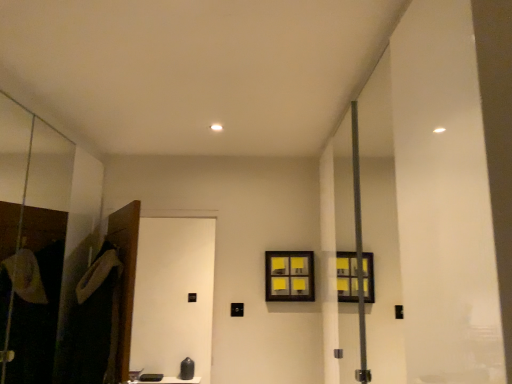
Describe the element at coordinates (31, 240) in the screenshot. This screenshot has width=512, height=384. I see `transparent glass screen door at left, the 1th screen door viewed from the left` at that location.

The height and width of the screenshot is (384, 512). Identify the location of dark gray fabric robe at left. (93, 323).

Where is `transparent glass screen door at left, marked as the 2th screen door in a right-to-left arrangement`? Image resolution: width=512 pixels, height=384 pixels. transparent glass screen door at left, marked as the 2th screen door in a right-to-left arrangement is located at coordinates (31, 240).

Measure the distance from dark gray fabric robe at left to transparent glass screen door at left, the 1th screen door viewed from the left.

A distance of 11.78 inches exists between dark gray fabric robe at left and transparent glass screen door at left, the 1th screen door viewed from the left.

Relative to transparent glass screen door at left, marked as the 2th screen door in a right-to-left arrangement, is dark gray fabric robe at left in front or behind?

Visually, dark gray fabric robe at left is located behind transparent glass screen door at left, marked as the 2th screen door in a right-to-left arrangement.

Locate an element on the screen. The width and height of the screenshot is (512, 384). screen door that is the 2nd one above the dark gray fabric robe at left (from a real-world perspective) is located at coordinates (31, 240).

Is dark gray fabric robe at left at the left side of transparent glass screen door at left, the 1th screen door viewed from the left?

In fact, dark gray fabric robe at left is to the right of transparent glass screen door at left, the 1th screen door viewed from the left.

From the image's perspective, is transparent glass screen door at left, the 1th screen door viewed from the left, positioned above or below black matte screen door at lower left, which is the 2th screen door in left-to-right order?

transparent glass screen door at left, the 1th screen door viewed from the left, is situated higher than black matte screen door at lower left, which is the 2th screen door in left-to-right order, in the image.

Which object is closer to the camera taking this photo, transparent glass screen door at left, the 1th screen door viewed from the left, or black matte screen door at lower left, which is the 2th screen door in left-to-right order?

Positioned in front is transparent glass screen door at left, the 1th screen door viewed from the left.

Which object is positioned more to the left, transparent glass screen door at left, marked as the 2th screen door in a right-to-left arrangement, or black matte screen door at lower left, which appears as the 1th screen door when viewed from the right?

From the viewer's perspective, transparent glass screen door at left, marked as the 2th screen door in a right-to-left arrangement, appears more on the left side.

Which is in front, point (3, 97) or point (203, 240)?

Point (3, 97)

Is black matte screen door at lower left, which is the 2th screen door in left-to-right order, next to yellow sticky notes at center and touching it?

black matte screen door at lower left, which is the 2th screen door in left-to-right order, is not next to yellow sticky notes at center, and they're not touching.

From a real-world perspective, is black matte screen door at lower left, which is the 2th screen door in left-to-right order, above or below yellow sticky notes at center?

Clearly, from a real-world perspective, black matte screen door at lower left, which is the 2th screen door in left-to-right order, is below yellow sticky notes at center.

Considering the positions of objects black matte screen door at lower left, which appears as the 1th screen door when viewed from the right, and yellow sticky notes at center in the image provided, who is more to the left, black matte screen door at lower left, which appears as the 1th screen door when viewed from the right, or yellow sticky notes at center?

black matte screen door at lower left, which appears as the 1th screen door when viewed from the right, is more to the left.

Is black matte screen door at lower left, which is the 2th screen door in left-to-right order, completely or partially outside of yellow sticky notes at center?

Yes, black matte screen door at lower left, which is the 2th screen door in left-to-right order, is not within yellow sticky notes at center.

Does black matte screen door at lower left, which appears as the 1th screen door when viewed from the right, appear on the left side of transparent glass screen door at left, marked as the 2th screen door in a right-to-left arrangement?

Incorrect, black matte screen door at lower left, which appears as the 1th screen door when viewed from the right, is not on the left side of transparent glass screen door at left, marked as the 2th screen door in a right-to-left arrangement.

The height and width of the screenshot is (384, 512). I want to click on screen door lying behind the transparent glass screen door at left, marked as the 2th screen door in a right-to-left arrangement, so click(x=174, y=296).

In the scene shown: Can you confirm if black matte screen door at lower left, which appears as the 1th screen door when viewed from the right, is taller than transparent glass screen door at left, marked as the 2th screen door in a right-to-left arrangement?

Incorrect, the height of black matte screen door at lower left, which appears as the 1th screen door when viewed from the right, is not larger of that of transparent glass screen door at left, marked as the 2th screen door in a right-to-left arrangement.

Could transparent glass screen door at left, marked as the 2th screen door in a right-to-left arrangement, be considered to be inside black matte screen door at lower left, which is the 2th screen door in left-to-right order?

That's incorrect, transparent glass screen door at left, marked as the 2th screen door in a right-to-left arrangement, is not inside black matte screen door at lower left, which is the 2th screen door in left-to-right order.

From the image's perspective, is dark gray fabric robe at left located above or below black matte screen door at lower left, which appears as the 1th screen door when viewed from the right?

dark gray fabric robe at left is above black matte screen door at lower left, which appears as the 1th screen door when viewed from the right.

Identify the location of screen door that appears on the right of dark gray fabric robe at left. (174, 296).

Is point (95, 331) closer to camera compared to point (190, 341)?

Yes, it is.

Could you tell me if dark gray fabric robe at left is turned towards black matte screen door at lower left, which appears as the 1th screen door when viewed from the right?

No.

Is transparent glass screen door at left, the 1th screen door viewed from the left, not near dark gray fabric robe at left?

They are positioned close to each other.

Image resolution: width=512 pixels, height=384 pixels. I want to click on robe below the transparent glass screen door at left, marked as the 2th screen door in a right-to-left arrangement (from the image's perspective), so click(93, 323).

Between transparent glass screen door at left, marked as the 2th screen door in a right-to-left arrangement, and dark gray fabric robe at left, which one has larger width?

Wider between the two is dark gray fabric robe at left.

Is transparent glass screen door at left, the 1th screen door viewed from the left, situated inside dark gray fabric robe at left or outside?

transparent glass screen door at left, the 1th screen door viewed from the left, lies outside dark gray fabric robe at left.

From the image's perspective, does transparent glass screen door at left, marked as the 2th screen door in a right-to-left arrangement, appear higher than yellow sticky notes at center?

Yes, from the image's perspective, transparent glass screen door at left, marked as the 2th screen door in a right-to-left arrangement, is on top of yellow sticky notes at center.

Could you tell me if transparent glass screen door at left, the 1th screen door viewed from the left, is facing yellow sticky notes at center?

Yes, transparent glass screen door at left, the 1th screen door viewed from the left, is oriented towards yellow sticky notes at center.

Considering the sizes of transparent glass screen door at left, marked as the 2th screen door in a right-to-left arrangement, and yellow sticky notes at center in the image, is transparent glass screen door at left, marked as the 2th screen door in a right-to-left arrangement, wider or thinner than yellow sticky notes at center?

Considering their sizes, transparent glass screen door at left, marked as the 2th screen door in a right-to-left arrangement, looks slimmer than yellow sticky notes at center.

Is transparent glass screen door at left, the 1th screen door viewed from the left, taller or shorter than yellow sticky notes at center?

Clearly, transparent glass screen door at left, the 1th screen door viewed from the left, is taller compared to yellow sticky notes at center.

Find the location of a particular element. screen door above the dark gray fabric robe at left (from the image's perspective) is located at coordinates (31, 240).

Where is `screen door located above the black matte screen door at lower left, which is the 2th screen door in left-to-right order (from a real-world perspective)`? screen door located above the black matte screen door at lower left, which is the 2th screen door in left-to-right order (from a real-world perspective) is located at coordinates (31, 240).

Looking at the image, which one is located further to dark gray fabric robe at left, transparent glass screen door at left, the 1th screen door viewed from the left, or yellow sticky notes at center?

Based on the image, yellow sticky notes at center appears to be further to dark gray fabric robe at left.

Considering their positions, is dark gray fabric robe at left positioned further to transparent glass screen door at left, marked as the 2th screen door in a right-to-left arrangement, than yellow sticky notes at center?

yellow sticky notes at center lies further to transparent glass screen door at left, marked as the 2th screen door in a right-to-left arrangement, than the other object.

Looking at the image, which one is located further to yellow sticky notes at center, black matte screen door at lower left, which appears as the 1th screen door when viewed from the right, or dark gray fabric robe at left?

black matte screen door at lower left, which appears as the 1th screen door when viewed from the right.

When comparing their distances from yellow sticky notes at center, does transparent glass screen door at left, marked as the 2th screen door in a right-to-left arrangement, or dark gray fabric robe at left seem closer?

Based on the image, dark gray fabric robe at left appears to be nearer to yellow sticky notes at center.

Considering their positions, is transparent glass screen door at left, the 1th screen door viewed from the left, positioned further to black matte screen door at lower left, which appears as the 1th screen door when viewed from the right, than yellow sticky notes at center?

transparent glass screen door at left, the 1th screen door viewed from the left, lies further to black matte screen door at lower left, which appears as the 1th screen door when viewed from the right, than the other object.

Considering their positions, is black matte screen door at lower left, which is the 2th screen door in left-to-right order, positioned closer to dark gray fabric robe at left than yellow sticky notes at center?

Result: yellow sticky notes at center is closer to dark gray fabric robe at left.

Based on their spatial positions, is yellow sticky notes at center or transparent glass screen door at left, the 1th screen door viewed from the left, closer to dark gray fabric robe at left?

Among the two, transparent glass screen door at left, the 1th screen door viewed from the left, is located nearer to dark gray fabric robe at left.

From the image, which object appears to be farther from black matte screen door at lower left, which is the 2th screen door in left-to-right order, yellow sticky notes at center or dark gray fabric robe at left?

dark gray fabric robe at left.

Find the location of a particular element. screen door between dark gray fabric robe at left and yellow sticky notes at center from left to right is located at coordinates (174, 296).

I want to click on screen door positioned between transparent glass screen door at left, the 1th screen door viewed from the left, and yellow sticky notes at center from near to far, so click(x=174, y=296).

What are the coordinates of `robe situated between transparent glass screen door at left, marked as the 2th screen door in a right-to-left arrangement, and yellow sticky notes at center from left to right` in the screenshot? It's located at (93, 323).

This screenshot has height=384, width=512. Find the location of `robe positioned between transparent glass screen door at left, marked as the 2th screen door in a right-to-left arrangement, and black matte screen door at lower left, which appears as the 1th screen door when viewed from the right, from near to far`. robe positioned between transparent glass screen door at left, marked as the 2th screen door in a right-to-left arrangement, and black matte screen door at lower left, which appears as the 1th screen door when viewed from the right, from near to far is located at coordinates (93, 323).